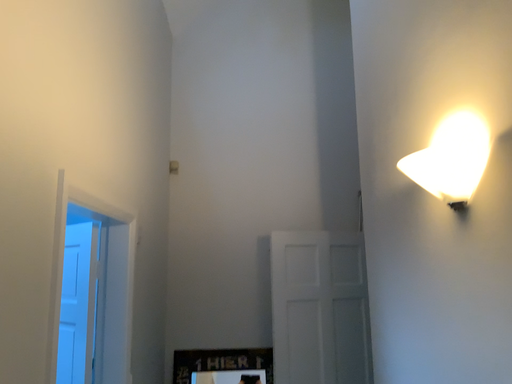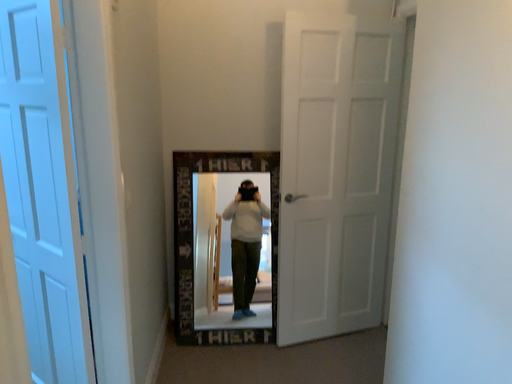
Question: Which way did the camera rotate in the video?

Choices:
 (A) rotated upward
 (B) rotated downward

Answer: (B)